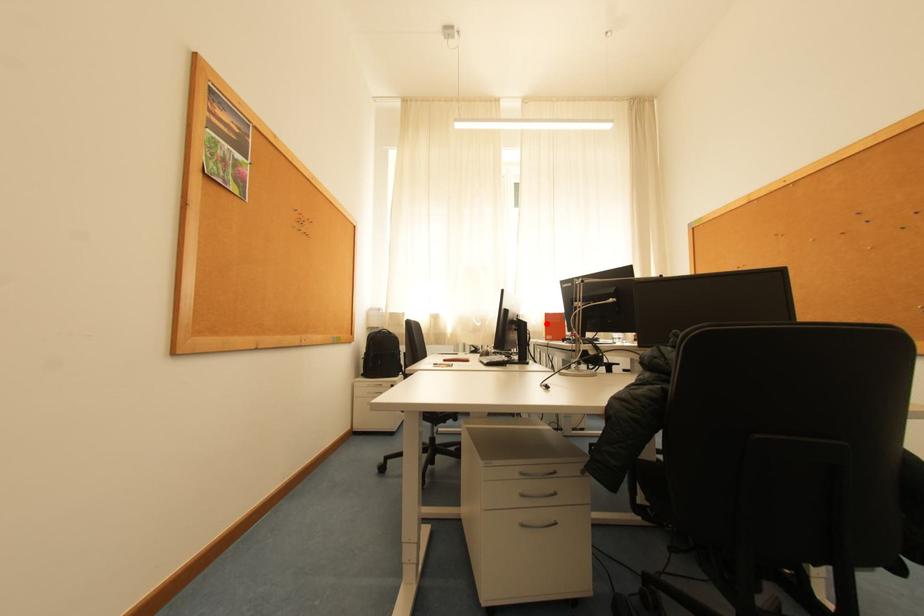
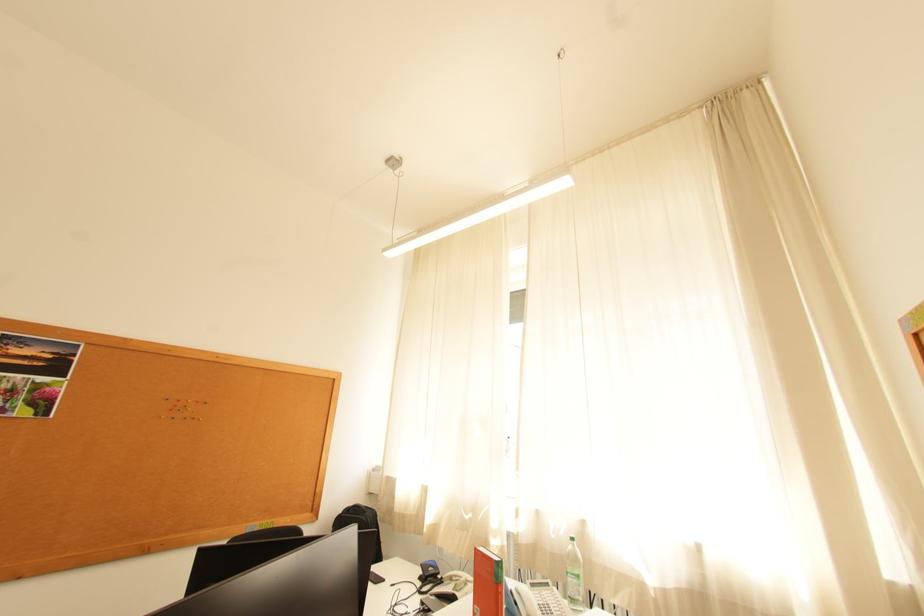
Where in the second image is the point corresponding to the highlighted location from the first image?

(569, 536)